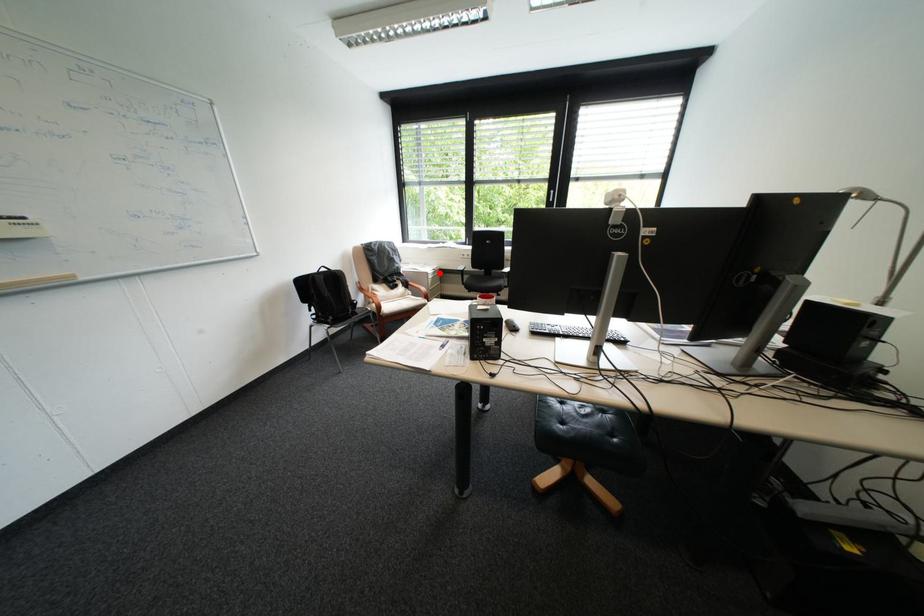
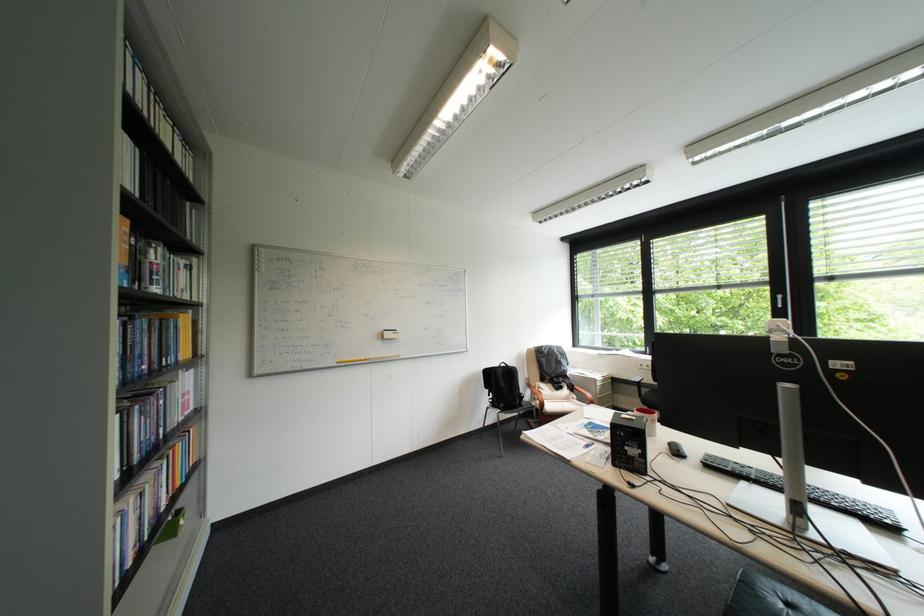
The point at the highlighted location is marked in the first image. Where is the corresponding point in the second image?

(608, 379)